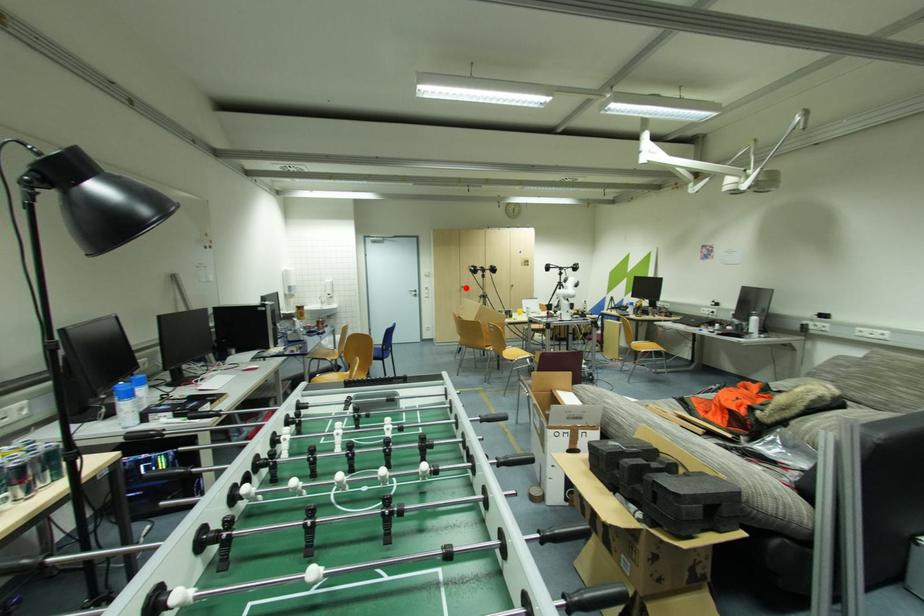
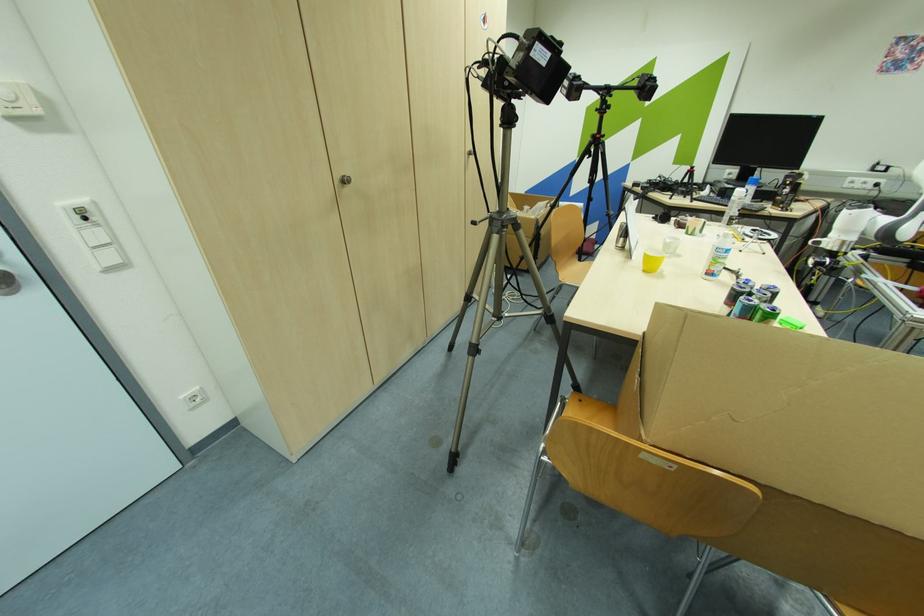
Where in the second image is the point corresponding to the highlighted location from the first image?

(348, 182)